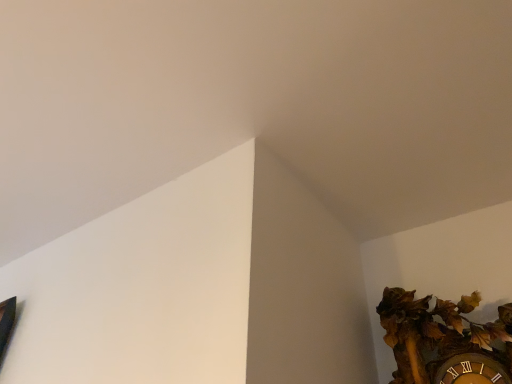
Describe the element at coordinates (444, 340) in the screenshot. I see `wooden clock at lower right` at that location.

The width and height of the screenshot is (512, 384). In order to click on wooden clock at lower right in this screenshot , I will do `click(444, 340)`.

Where is `wooden clock at lower right`? This screenshot has width=512, height=384. wooden clock at lower right is located at coordinates (444, 340).